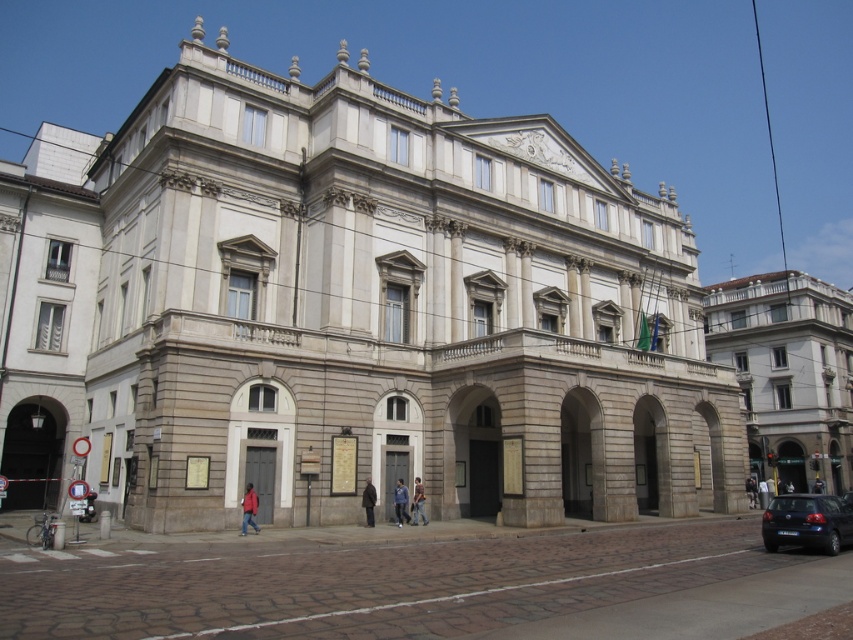
Does denim jacket at center have a larger size compared to dark blue jacket at center?

No, denim jacket at center is not bigger than dark blue jacket at center.

Does denim jacket at center have a greater height compared to dark blue jacket at center?

Incorrect, denim jacket at center's height is not larger of dark blue jacket at center's.

Does point (399, 477) lie in front of point (749, 492)?

That is True.

This screenshot has width=853, height=640. I want to click on denim jacket at center, so click(x=399, y=502).

Is point (786, 502) behind point (361, 493)?

No, it is in front of (361, 493).

You are a GUI agent. You are given a task and a screenshot of the screen. Output one action in this format:
    pyautogui.click(x=<x>, y=<y>)
    Task: Click on the dark blue matte car at lower right
    The height and width of the screenshot is (640, 853).
    Given the screenshot: What is the action you would take?
    pyautogui.click(x=805, y=522)

Can you confirm if denim jacket at center is taller than blue denim jeans at center?

Indeed, denim jacket at center has a greater height compared to blue denim jeans at center.

Which is behind, point (402, 490) or point (416, 492)?

The point (416, 492) is more distant.

You are a GUI agent. You are given a task and a screenshot of the screen. Output one action in this format:
    pyautogui.click(x=<x>, y=<y>)
    Task: Click on the denim jacket at center
    
    Given the screenshot: What is the action you would take?
    pyautogui.click(x=399, y=502)